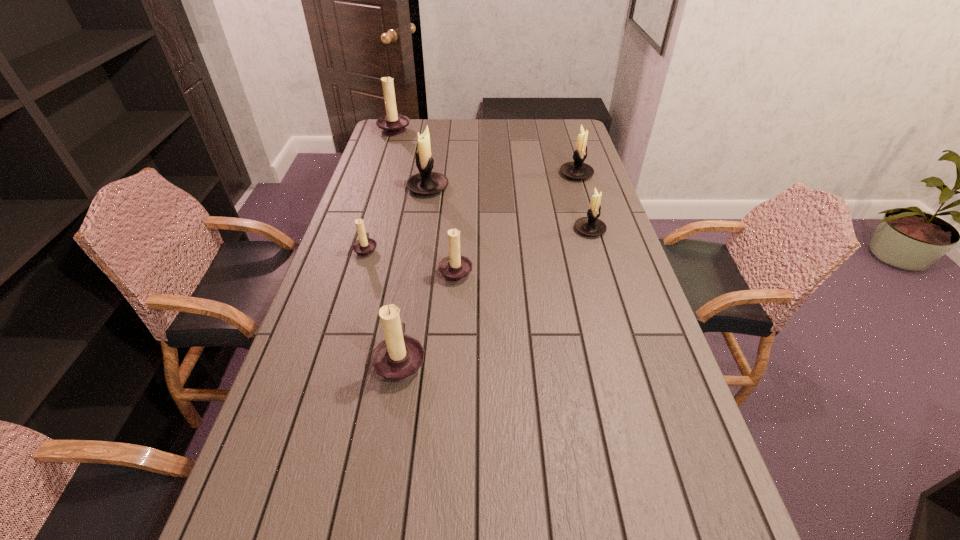
At what (x,y) coordinates should I click in order to perform the action: click on candle holder that is the closest to the third biggest brown candle holder. Please return your answer as a coordinate pair (x, y). This screenshot has width=960, height=540. Looking at the image, I should click on (398, 358).

I want to click on brown candle holder that is the second closest to the nearest brown candle holder, so click(x=365, y=246).

Select which brown candle holder appears as the second closest to the smallest brown candle holder. Please provide its 2D coordinates. Your answer should be formatted as a tuple, i.e. [(x, y)], where the tuple contains the x and y coordinates of a point satisfying the conditions above.

[(398, 358)]

You are a GUI agent. You are given a task and a screenshot of the screen. Output one action in this format:
    pyautogui.click(x=<x>, y=<y>)
    Task: Click on the white candle holder that is the closest to the biggest white candle holder
    This screenshot has width=960, height=540.
    Given the screenshot: What is the action you would take?
    pyautogui.click(x=578, y=170)

What are the coordinates of `white candle holder that stands as the third closest to the third biggest brown candle holder` in the screenshot? It's located at tap(578, 170).

In order to click on vacant space that satisfies the following two spatial constraints: 1. on the wick of the farthest object; 2. on the left side of the second smallest white candle holder in this screenshot , I will do `click(380, 174)`.

Image resolution: width=960 pixels, height=540 pixels. In order to click on vacant region that satisfies the following two spatial constraints: 1. on the front side of the fourth nearest object; 2. on the wick of the shortest candle holder in this screenshot , I will do `click(595, 249)`.

Identify the location of free space in the image that satisfies the following two spatial constraints: 1. on the wick of the farthest object; 2. on the right side of the second biggest white candle holder. This screenshot has width=960, height=540. (380, 174).